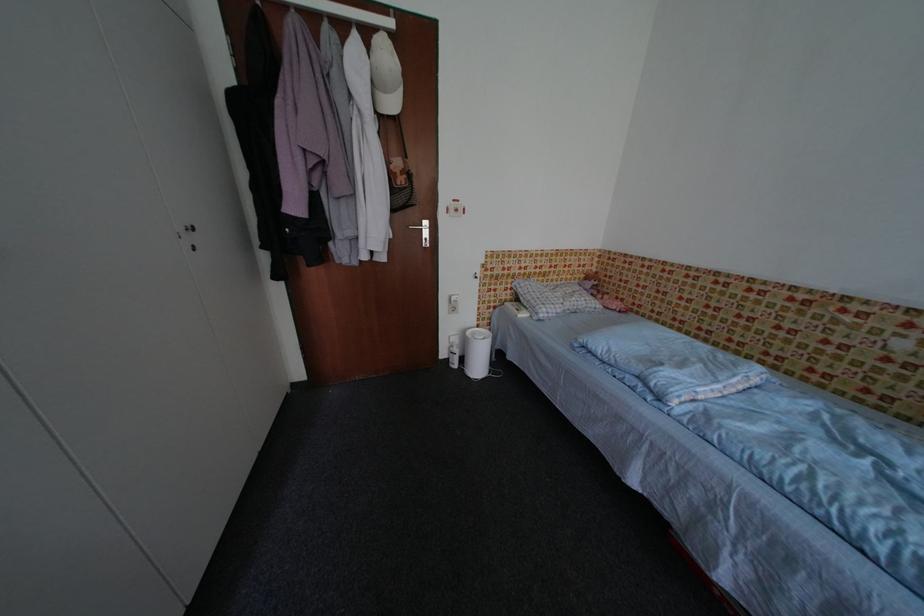
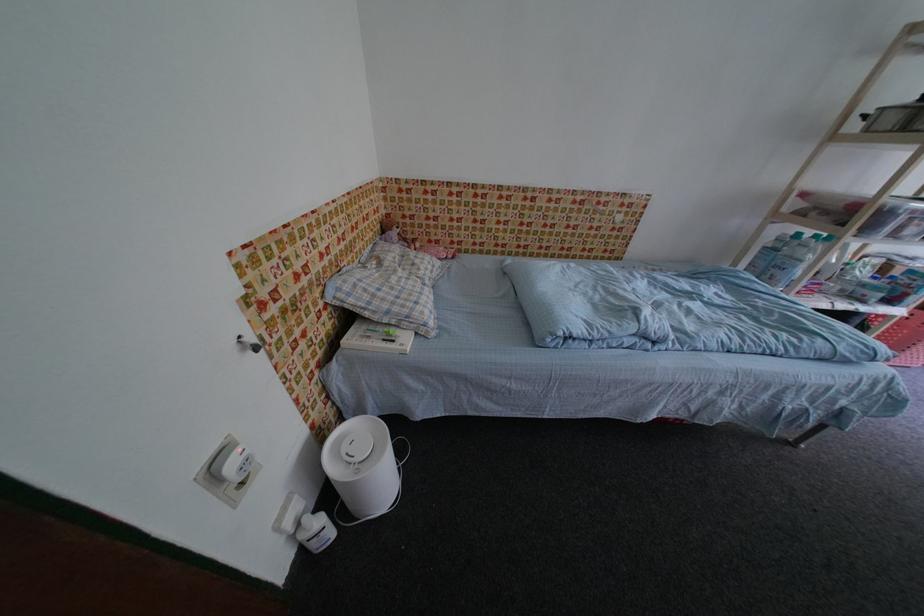
The point at (564, 280) is marked in the first image. Where is the corresponding point in the second image?

(370, 246)